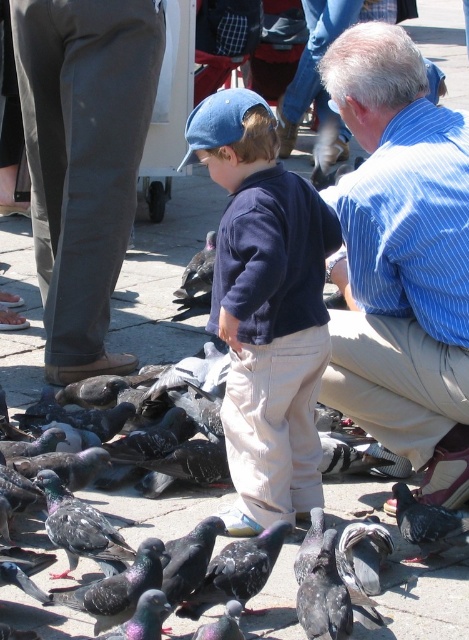
Can you confirm if matte blue cap at center is positioned to the right of gray speckled feathers at lower right?

In fact, matte blue cap at center is to the left of gray speckled feathers at lower right.

Can you confirm if matte blue cap at center is smaller than gray speckled feathers at lower right?

No.

Who is more distant from viewer, (261, 300) or (447, 531)?

Positioned behind is point (447, 531).

You are a GUI agent. You are given a task and a screenshot of the screen. Output one action in this format:
    pyautogui.click(x=<x>, y=<y>)
    Task: Click on the matte blue cap at center
    Image resolution: width=469 pixels, height=640 pixels.
    Given the screenshot: What is the action you would take?
    pyautogui.click(x=265, y=308)

Can you confirm if blue striped shirt at upper right is positioned to the left of matte blue cap at center?

In fact, blue striped shirt at upper right is to the right of matte blue cap at center.

Does blue striped shirt at upper right have a smaller size compared to matte blue cap at center?

Actually, blue striped shirt at upper right might be larger than matte blue cap at center.

Describe the element at coordinates (401, 260) in the screenshot. I see `blue striped shirt at upper right` at that location.

Locate an element on the screen. blue striped shirt at upper right is located at coordinates (401, 260).

Does dark gray pants at lower left come in front of gray speckled feathers at lower right?

No, dark gray pants at lower left is further to the viewer.

Between dark gray pants at lower left and gray speckled feathers at lower right, which one has more height?

Standing taller between the two is dark gray pants at lower left.

This screenshot has width=469, height=640. In order to click on dark gray pants at lower left in this screenshot , I will do `click(83, 160)`.

The width and height of the screenshot is (469, 640). In order to click on dark gray pants at lower left in this screenshot , I will do `click(83, 160)`.